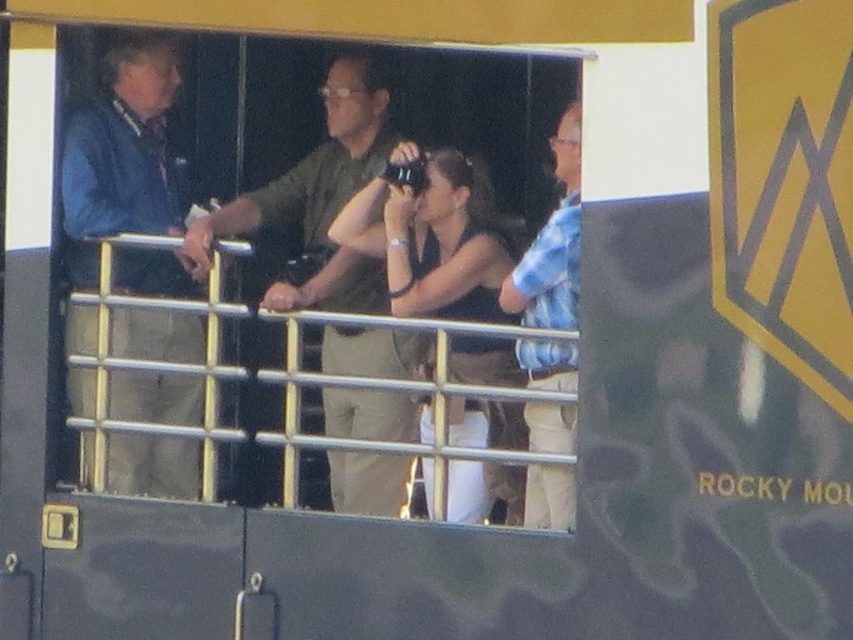
Which of these two, transparent glass at center or blue fabric jacket at left, stands shorter?

Standing shorter between the two is blue fabric jacket at left.

The image size is (853, 640). I want to click on transparent glass at center, so click(347, 208).

I want to click on transparent glass at center, so click(347, 208).

In order to click on green matte shirt at center in this screenshot , I will do `click(316, 200)`.

Who is positioned more to the left, green matte shirt at center or blue striped shirt at right?

Positioned to the left is green matte shirt at center.

Where is `green matte shirt at center`? The width and height of the screenshot is (853, 640). green matte shirt at center is located at coordinates (316, 200).

Can you confirm if black matte tank top at center is bigger than blue striped shirt at right?

Yes.

Looking at this image, does black matte tank top at center have a greater width compared to blue striped shirt at right?

Yes, black matte tank top at center is wider than blue striped shirt at right.

This screenshot has height=640, width=853. What are the coordinates of `black matte tank top at center` in the screenshot? It's located at (432, 236).